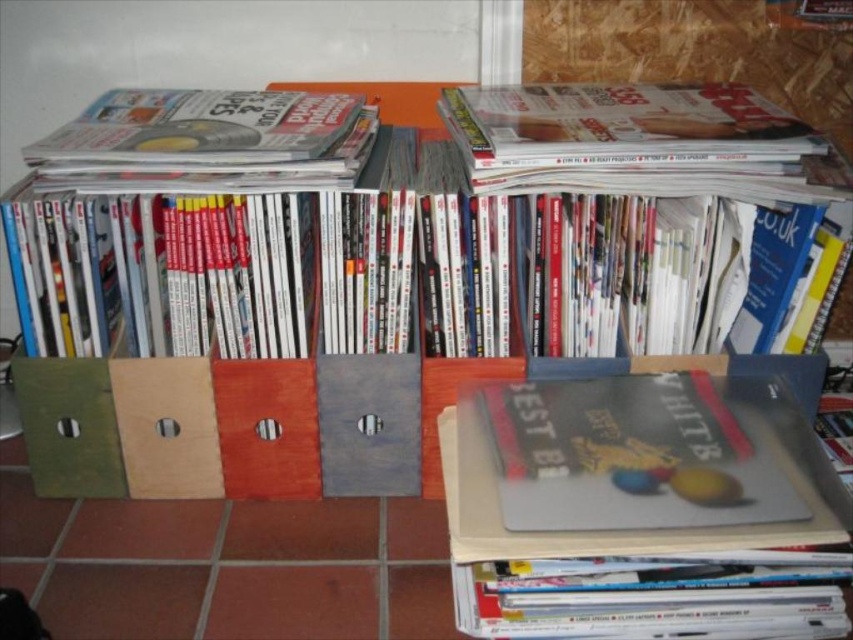
Consider the image. Is matte gray book at center to the left of matte black book at center from the viewer's perspective?

Incorrect, matte gray book at center is not on the left side of matte black book at center.

The width and height of the screenshot is (853, 640). In order to click on matte gray book at center in this screenshot , I will do `click(639, 500)`.

Locate an element on the screen. Image resolution: width=853 pixels, height=640 pixels. matte gray book at center is located at coordinates (639, 500).

Does wooden bookshelf at center have a larger size compared to matte black book at center?

Correct, wooden bookshelf at center is larger in size than matte black book at center.

Which is in front, point (360, 406) or point (500, 419)?

Point (500, 419) is more forward.

Measure the distance between wooden bookshelf at center and camera.

The distance of wooden bookshelf at center from camera is 38.02 inches.

The width and height of the screenshot is (853, 640). Identify the location of wooden bookshelf at center. (334, 316).

Does wooden bookshelf at center have a lesser width compared to matte gray book at center?

No, wooden bookshelf at center is not thinner than matte gray book at center.

Does wooden bookshelf at center have a greater height compared to matte gray book at center?

Correct, wooden bookshelf at center is much taller as matte gray book at center.

Which is in front, point (722, 214) or point (734, 492)?

Point (734, 492)

Where is `wooden bookshelf at center`? The height and width of the screenshot is (640, 853). wooden bookshelf at center is located at coordinates (334, 316).